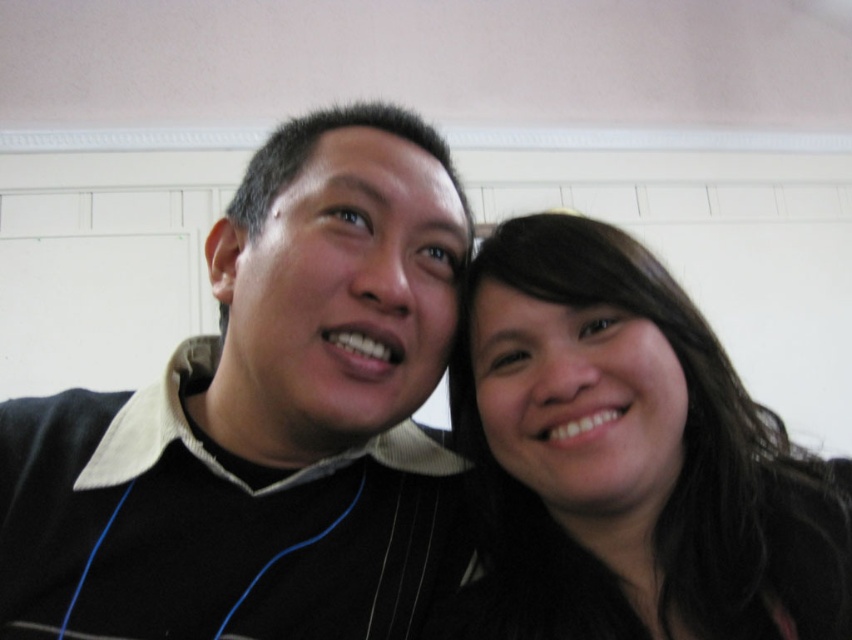
Does black matte sweater at center have a smaller size compared to dark brown hair at center?

Actually, black matte sweater at center might be larger than dark brown hair at center.

Which is behind, point (390, 337) or point (684, 540)?

The point (684, 540) is more distant.

Identify the location of black matte sweater at center. The image size is (852, 640). (265, 420).